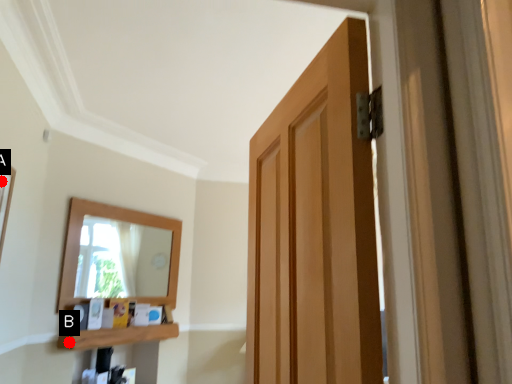
Question: Two points are circled on the image, labeled by A and B beside each circle. Which point is closer to the camera?

Choices:
 (A) A is closer
 (B) B is closer

Answer: (A)